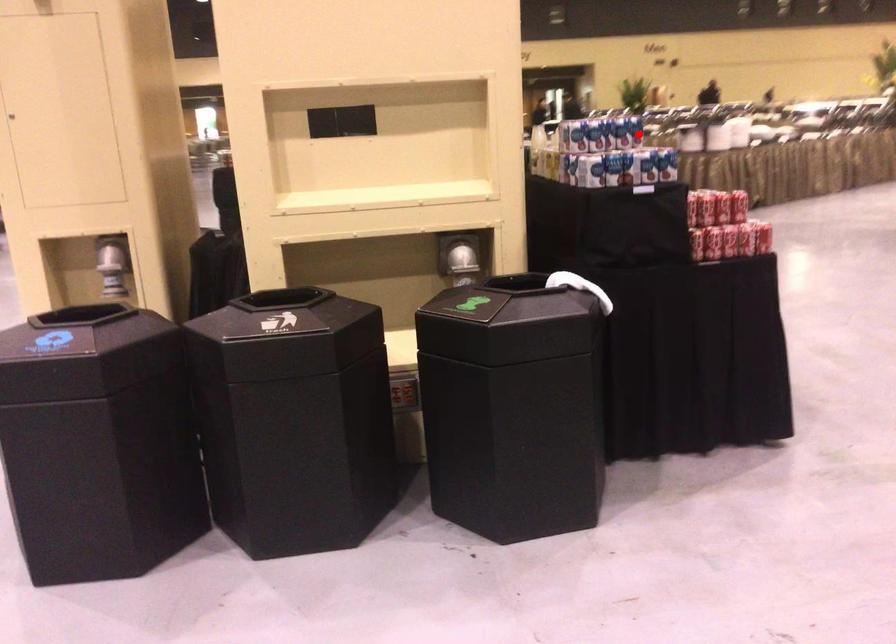
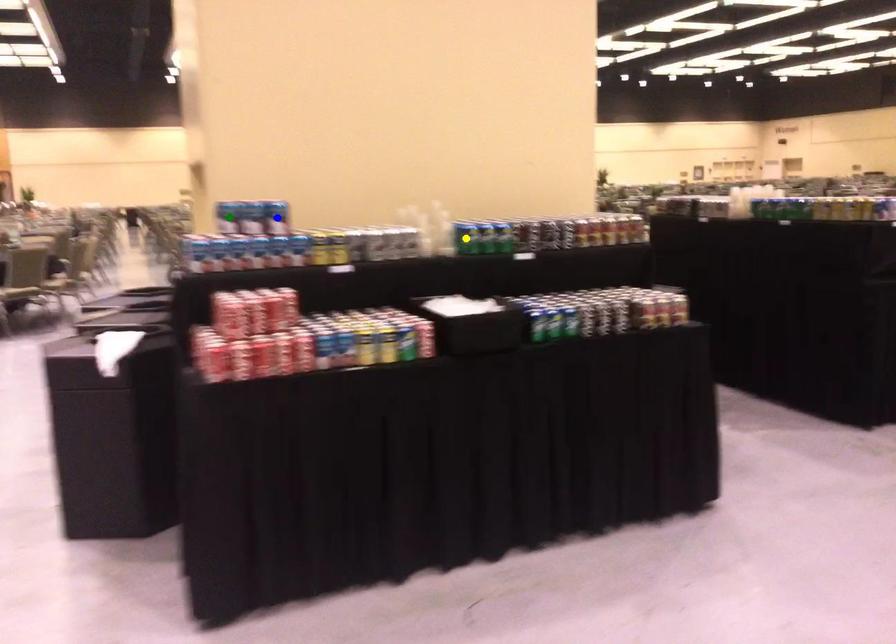
Question: I am providing you with two images of the same scene from different viewpoints. A red point is marked on the first image. You are given multiple points on the second image. Which point in image 2 is actually the same real-world point as the red point in image 1?

Choices:
 (A) green point
 (B) blue point
 (C) yellow point

Answer: (B)